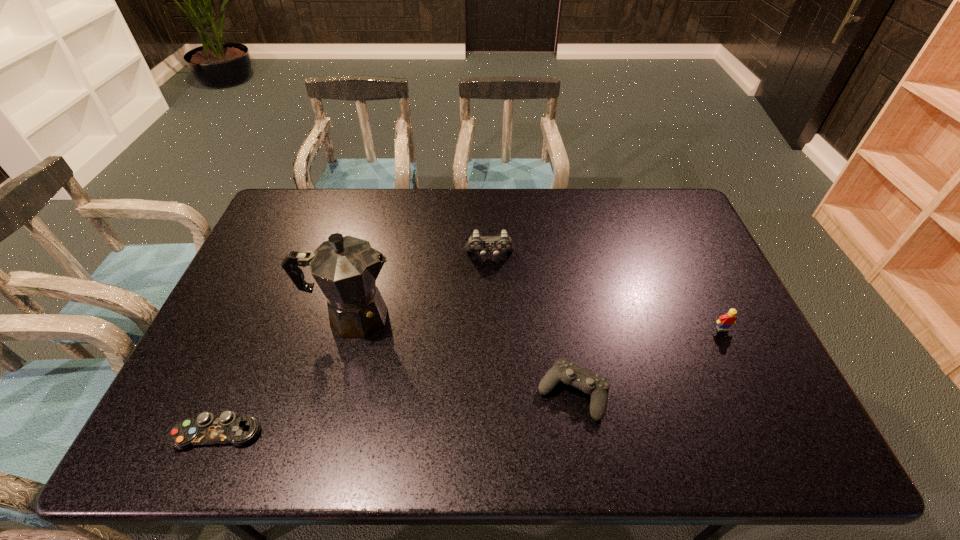
Locate an element on the screen. free space between the second shortest control and the leftmost object is located at coordinates (396, 413).

At what (x,y) coordinates should I click in order to perform the action: click on vacant area between the fourth object from right to left and the second shortest object. Please return your answer as a coordinate pair (x, y). Looking at the image, I should click on (463, 355).

The height and width of the screenshot is (540, 960). I want to click on free space between the second shortest control and the coffeepot, so click(463, 355).

Find the location of a particular element. This screenshot has height=540, width=960. unoccupied area between the third object from right to left and the second tallest control is located at coordinates (531, 325).

At what (x,y) coordinates should I click in order to perform the action: click on the fourth closest object relative to the rightmost object. Please return your answer as a coordinate pair (x, y). This screenshot has width=960, height=540. Looking at the image, I should click on (227, 428).

Identify which object is the second closest to the shortest control. Please provide its 2D coordinates. Your answer should be formatted as a tuple, i.e. [(x, y)], where the tuple contains the x and y coordinates of a point satisfying the conditions above.

[(597, 386)]

At what (x,y) coordinates should I click in order to perform the action: click on the second closest control to the second control from left to right. Please return your answer as a coordinate pair (x, y). The image size is (960, 540). Looking at the image, I should click on (227, 428).

The width and height of the screenshot is (960, 540). In order to click on the closest control to the second tallest control in this screenshot , I will do `click(476, 243)`.

Locate an element on the screen. The width and height of the screenshot is (960, 540). vacant space that satisfies the following two spatial constraints: 1. on the surface of the tallest control with buttons; 2. on the right side of the fourth tallest object is located at coordinates (492, 393).

At what (x,y) coordinates should I click in order to perform the action: click on vacant space that satisfies the following two spatial constraints: 1. on the surface of the fourth shortest object with buttons; 2. on the pouring side of the coffeepot. Please return your answer as a coordinate pair (x, y). The image size is (960, 540). Looking at the image, I should click on pyautogui.click(x=492, y=317).